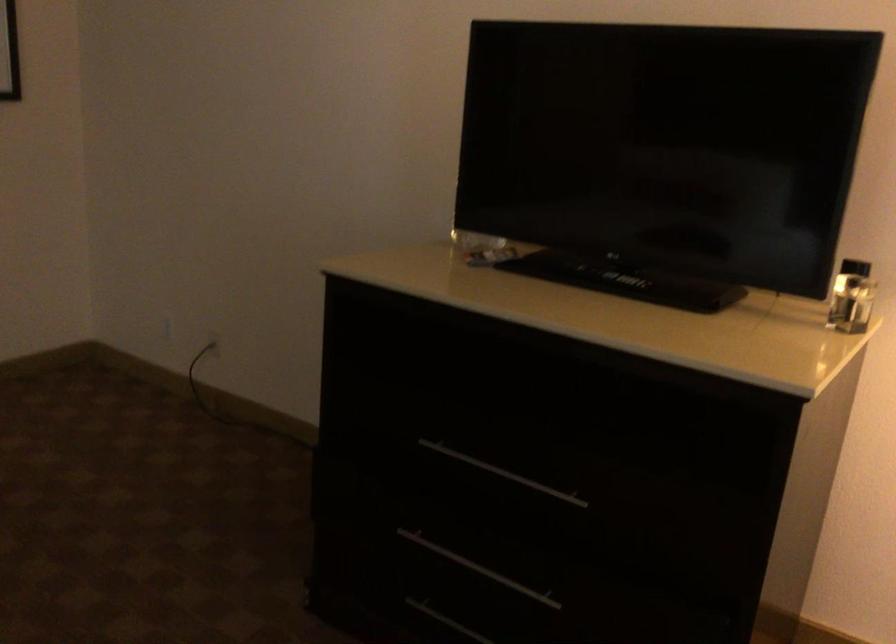
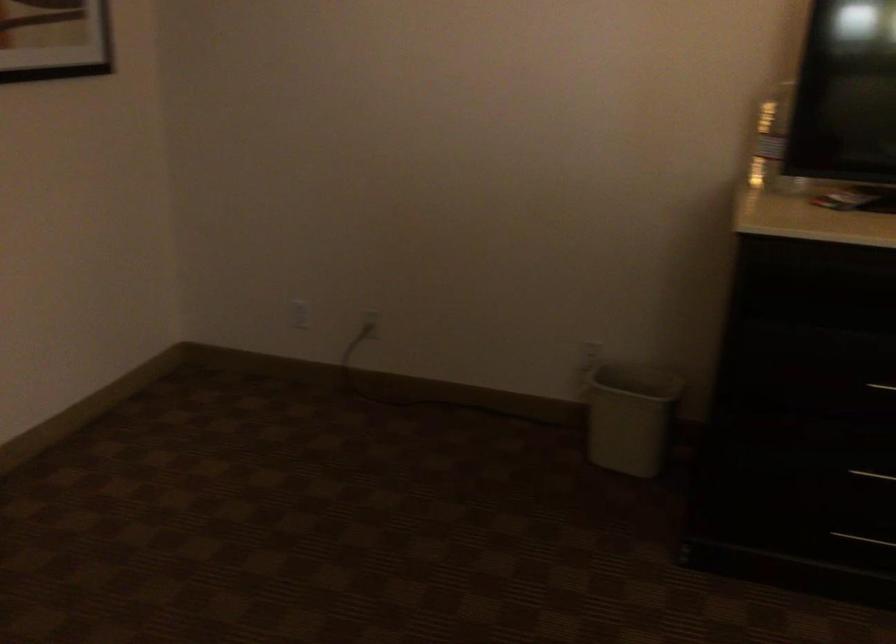
Question: Which direction would the cameraman need to move to produce the second image? Reply with the corresponding letter.

Choices:
 (A) Left
 (B) Right
 (C) Forward
 (D) Backward

Answer: (A)